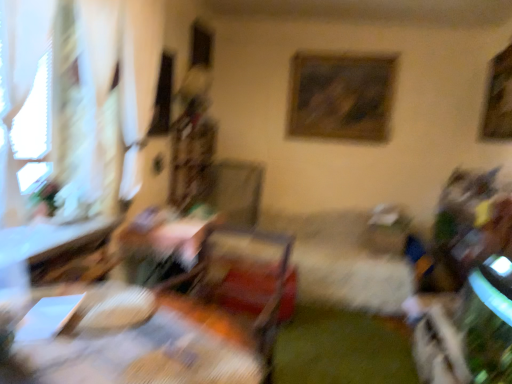
Question: Can you confirm if wooden swivel chair at center is positioned to the left of wooden framed picture at upper right, which is the 1th picture frame in front-to-back order?

Choices:
 (A) no
 (B) yes

Answer: (B)

Question: Is wooden swivel chair at center bigger than wooden framed picture at upper right, the 1th picture frame positioned from the right?

Choices:
 (A) yes
 (B) no

Answer: (A)

Question: Is wooden swivel chair at center directly adjacent to wooden framed picture at upper right, which is the 1th picture frame in front-to-back order?

Choices:
 (A) no
 (B) yes

Answer: (A)

Question: Is wooden swivel chair at center wider than wooden framed picture at upper right, the 2th picture frame viewed from the left?

Choices:
 (A) yes
 (B) no

Answer: (A)

Question: Can you confirm if wooden swivel chair at center is thinner than wooden framed picture at upper right, the 1th picture frame positioned from the right?

Choices:
 (A) yes
 (B) no

Answer: (B)

Question: From a real-world perspective, is wooden framed picture at upper right, the 2th picture frame viewed from the left, above or below wooden table at left, the first table in the back-to-front sequence?

Choices:
 (A) below
 (B) above

Answer: (B)

Question: Relative to wooden table at left, the 2th table when ordered from front to back, is wooden framed picture at upper right, which is the 1th picture frame in front-to-back order, in front or behind?

Choices:
 (A) behind
 (B) front

Answer: (A)

Question: Is wooden framed picture at upper right, which is the 1th picture frame in front-to-back order, bigger or smaller than wooden table at left, the 2th table when ordered from front to back?

Choices:
 (A) small
 (B) big

Answer: (A)

Question: Based on their positions, is wooden framed picture at upper right, the 1th picture frame positioned from the right, located to the left or right of wooden table at left, the 2th table when ordered from front to back?

Choices:
 (A) right
 (B) left

Answer: (A)

Question: Is point (287, 119) positioned closer to the camera than point (165, 374)?

Choices:
 (A) farther
 (B) closer

Answer: (A)

Question: In terms of height, does wooden framed painting at upper center, the 2th picture frame from the right, look taller or shorter compared to wooden table at center, marked as the second table in a back-to-front arrangement?

Choices:
 (A) short
 (B) tall

Answer: (B)

Question: From the image's perspective, is wooden framed painting at upper center, acting as the 1th picture frame starting from the back, located above or below wooden table at center, placed as the 1th table when sorted from front to back?

Choices:
 (A) above
 (B) below

Answer: (A)

Question: Would you say wooden framed painting at upper center, the first picture frame from the left, is inside or outside wooden table at center, marked as the second table in a back-to-front arrangement?

Choices:
 (A) inside
 (B) outside

Answer: (B)

Question: From the image's perspective, is wooden swivel chair at center positioned above or below wooden framed painting at upper center, acting as the 1th picture frame starting from the back?

Choices:
 (A) below
 (B) above

Answer: (A)

Question: Choose the correct answer: Is wooden swivel chair at center inside wooden framed painting at upper center, the first picture frame from the left, or outside it?

Choices:
 (A) inside
 (B) outside

Answer: (B)